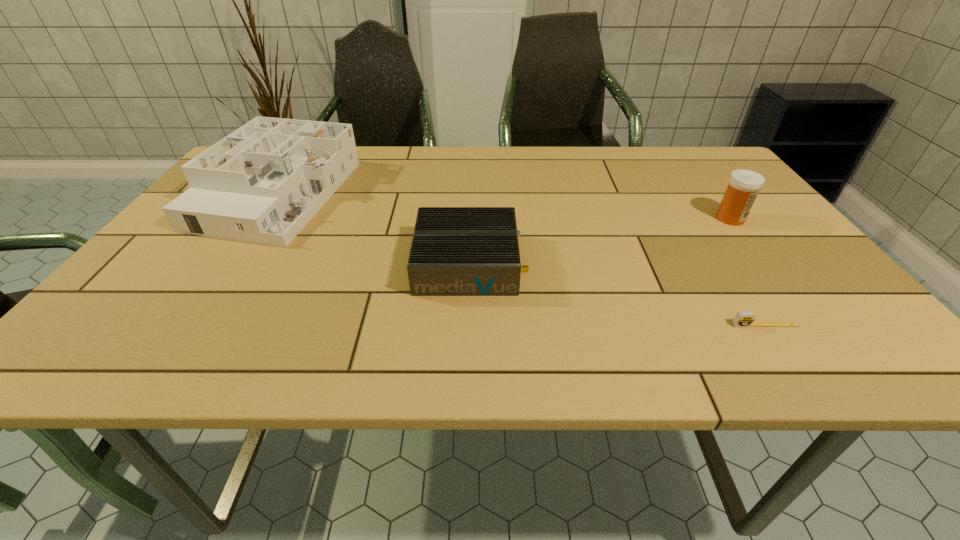
This screenshot has width=960, height=540. Identify the location of dollhouse. (263, 183).

Identify the location of medicine. (743, 186).

Identify the location of router. Image resolution: width=960 pixels, height=540 pixels. (456, 251).

I want to click on the third tallest object, so click(456, 251).

This screenshot has height=540, width=960. I want to click on tape measure, so click(743, 318).

You are a GUI agent. You are given a task and a screenshot of the screen. Output one action in this format:
    pyautogui.click(x=<x>, y=<y>)
    Task: Click on the shortest object
    The height and width of the screenshot is (540, 960).
    Given the screenshot: What is the action you would take?
    pyautogui.click(x=743, y=318)

Locate an element on the screen. The image size is (960, 540). vacant region located 0.330m on the front of the dollhouse is located at coordinates (164, 362).

This screenshot has width=960, height=540. I want to click on vacant space located on the left of the medicine, so click(604, 218).

This screenshot has height=540, width=960. I want to click on vacant area situated on the back panel of the second shortest object, so click(x=693, y=264).

Where is `free location located 0.090m at the front of the shortest object with the tape extended`? Image resolution: width=960 pixels, height=540 pixels. free location located 0.090m at the front of the shortest object with the tape extended is located at coordinates (793, 367).